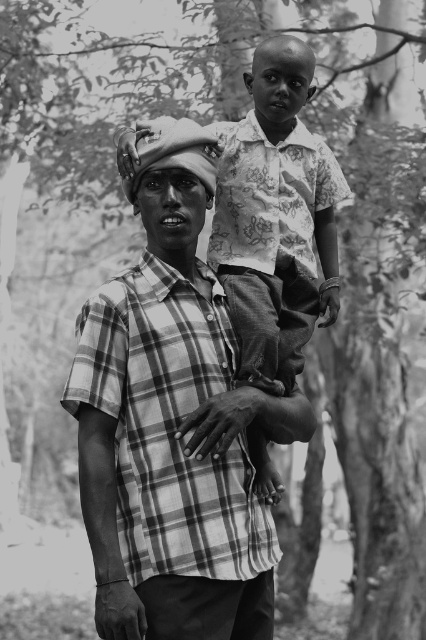
Is point (143, 529) farther from viewer compared to point (129, 150)?

That is False.

Who is more forward, (183, 392) or (242, 326)?

Positioned in front is point (183, 392).

Which is behind, point (104, 451) or point (298, 51)?

Point (298, 51)

This screenshot has width=426, height=640. Identify the location of plaid fabric shirt at center. (169, 440).